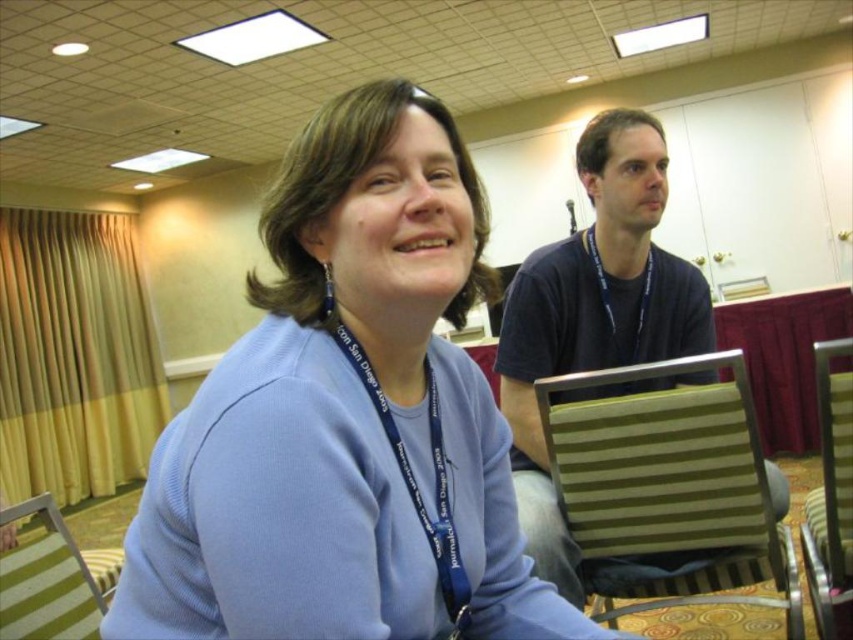
You are organizing a clothing drive and need to determine which item takes up more space between the matte blue sweater at center and the blue fabric lanyard at upper center. Which item would require more storage space?

The matte blue sweater at center has a larger size compared to the blue fabric lanyard at upper center, so it requires more storage space.

You are a photographer setting up for a group photo in the conference room. You need to adjust the height of your camera so that both the striped fabric chair at lower left and the metallic striped chair at right are in focus. Which chair should you focus on first to ensure both are in focus?

You should focus on the metallic striped chair at right first because it is taller than the striped fabric chair at lower left, allowing the camera to capture both within the depth of field.